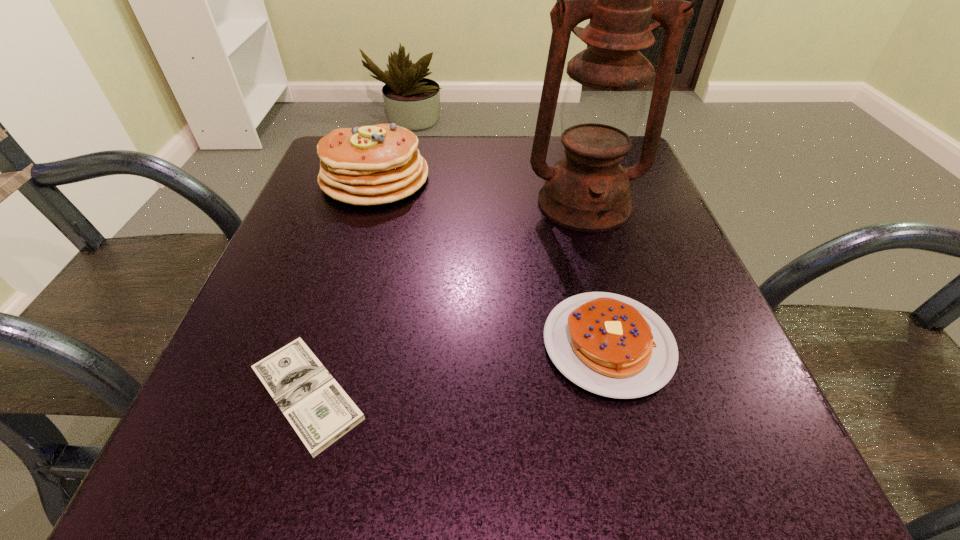
Where is `oil lamp`? The height and width of the screenshot is (540, 960). oil lamp is located at coordinates (603, 106).

Identify the location of the second tallest object. (369, 165).

Where is `the left pancake`? The image size is (960, 540). the left pancake is located at coordinates (369, 165).

I want to click on the shorter pancake, so click(611, 345).

Locate an element on the screen. The height and width of the screenshot is (540, 960). the second shortest object is located at coordinates (611, 345).

Where is `dollar`? The image size is (960, 540). dollar is located at coordinates (318, 409).

The image size is (960, 540). I want to click on vacant space located on the back of the oil lamp, so [565, 137].

Image resolution: width=960 pixels, height=540 pixels. I want to click on vacant region located on the right of the farther pancake, so click(496, 179).

Locate an element on the screen. This screenshot has height=540, width=960. vacant space located on the back of the right pancake is located at coordinates (579, 228).

Where is `vacant region located 0.280m on the back of the shortest object`? The height and width of the screenshot is (540, 960). vacant region located 0.280m on the back of the shortest object is located at coordinates (359, 225).